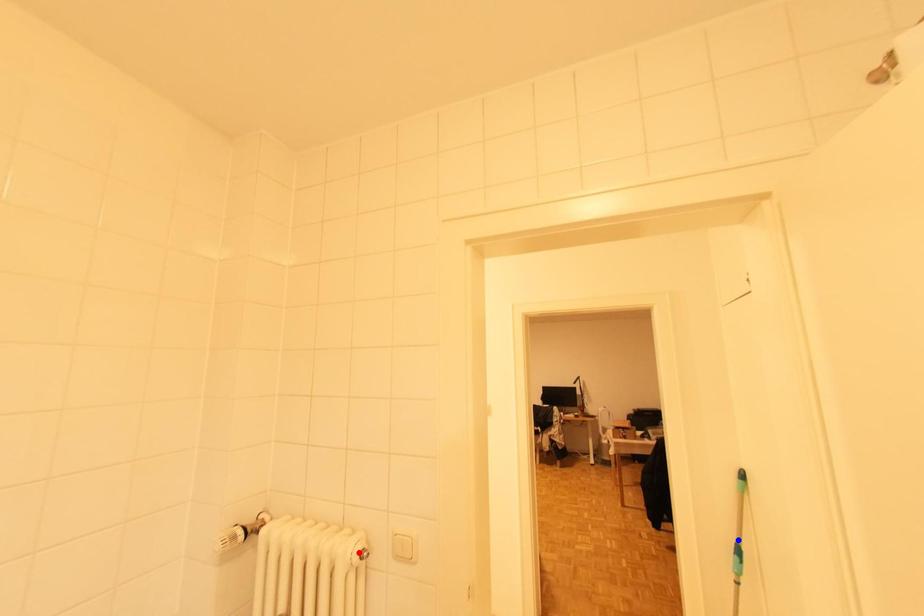
Question: In the image, two points are highlighted. Which point is nearer to the camera? Reply with the corresponding letter.

Choices:
 (A) blue point
 (B) red point

Answer: (B)